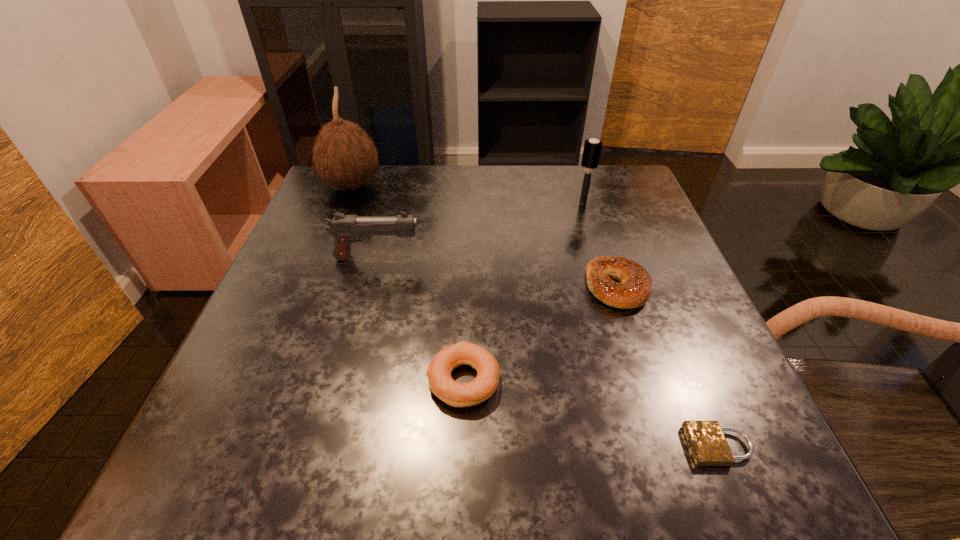
At what (x,y) coordinates should I click in order to perform the action: click on object that is at the near edge. Please return your answer as a coordinate pair (x, y). The image size is (960, 540). Looking at the image, I should click on (707, 443).

Locate an element on the screen. The width and height of the screenshot is (960, 540). coconut located at the left edge is located at coordinates (344, 155).

This screenshot has width=960, height=540. What are the coordinates of `gun that is at the left edge` in the screenshot? It's located at 345,229.

The image size is (960, 540). I want to click on hairbrush situated at the right edge, so click(x=592, y=148).

You are a GUI agent. You are given a task and a screenshot of the screen. Output one action in this format:
    pyautogui.click(x=<x>, y=<y>)
    Task: Click on the bagel situated at the right edge
    
    Given the screenshot: What is the action you would take?
    pyautogui.click(x=634, y=290)

Locate an element on the screen. Image resolution: width=960 pixels, height=540 pixels. padlock situated at the right edge is located at coordinates (707, 443).

Where is `object that is at the far left corner`? The height and width of the screenshot is (540, 960). object that is at the far left corner is located at coordinates (344, 155).

Where is `object that is at the far right corner`? The width and height of the screenshot is (960, 540). object that is at the far right corner is located at coordinates (592, 148).

Locate an element on the screen. object that is at the near right corner is located at coordinates (707, 443).

I want to click on vacant space at the far edge, so (391, 174).